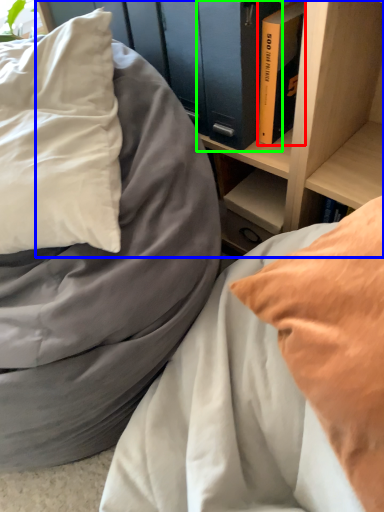
Question: Estimate the real-world distances between objects in this image. Which object is closer to book (highlighted by a red box), shelf (highlighted by a blue box) or paperback book (highlighted by a green box)?

Choices:
 (A) shelf
 (B) paperback book

Answer: (B)